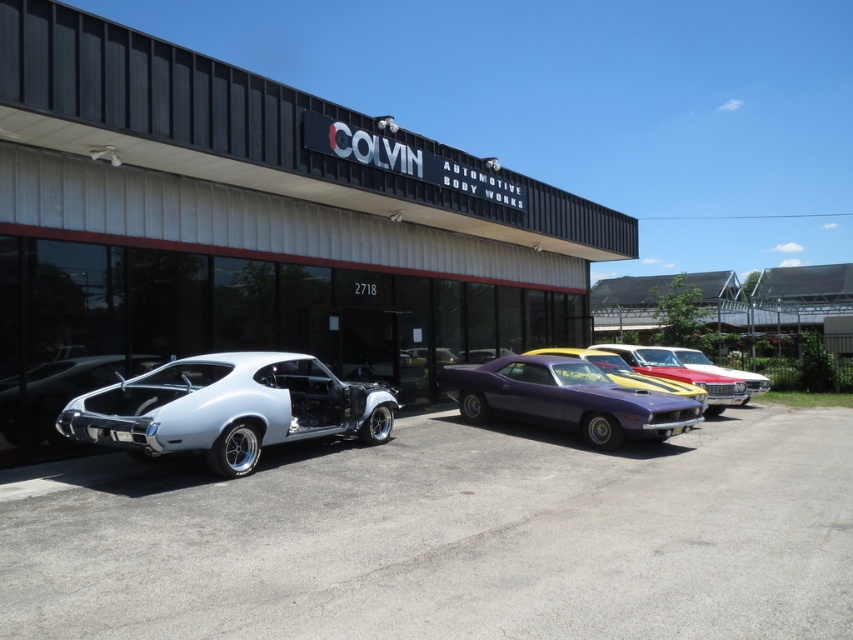
You are a customer visiting Colvin Automotive Body Works and see two cars in the center area, the chrome metallic car at center and the shiny red car at center. Which car takes up more space in the parking area?

The shiny red car at center takes up more space in the parking area because the chrome metallic car at center occupies less space than it.